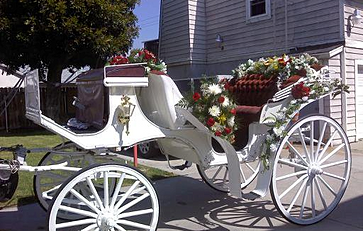
The height and width of the screenshot is (231, 363). Find the location of `window`. window is located at coordinates (260, 11).